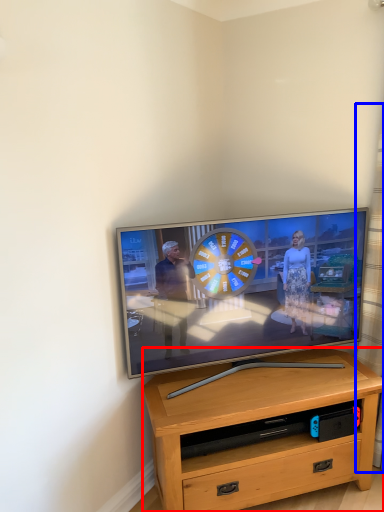
Question: Which point is further to the camera, desk (highlighted by a red box) or curtain (highlighted by a blue box)?

Choices:
 (A) desk
 (B) curtain

Answer: (A)